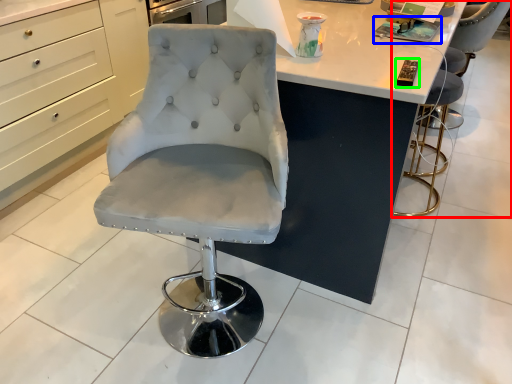
Question: Which object is the farthest from chair (highlighted by a red box)? Choose among these: magazine (highlighted by a blue box) or magazine (highlighted by a green box).

Choices:
 (A) magazine
 (B) magazine

Answer: (B)